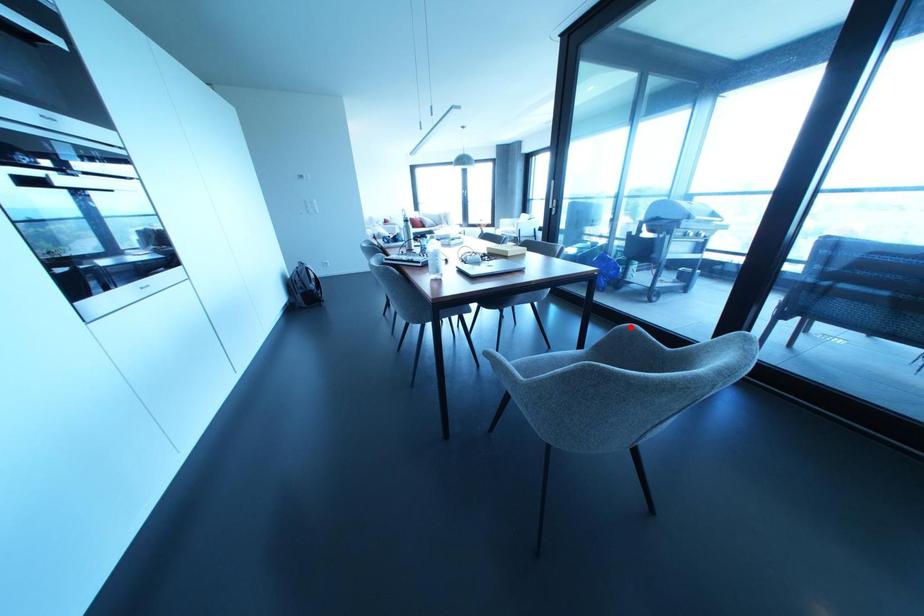
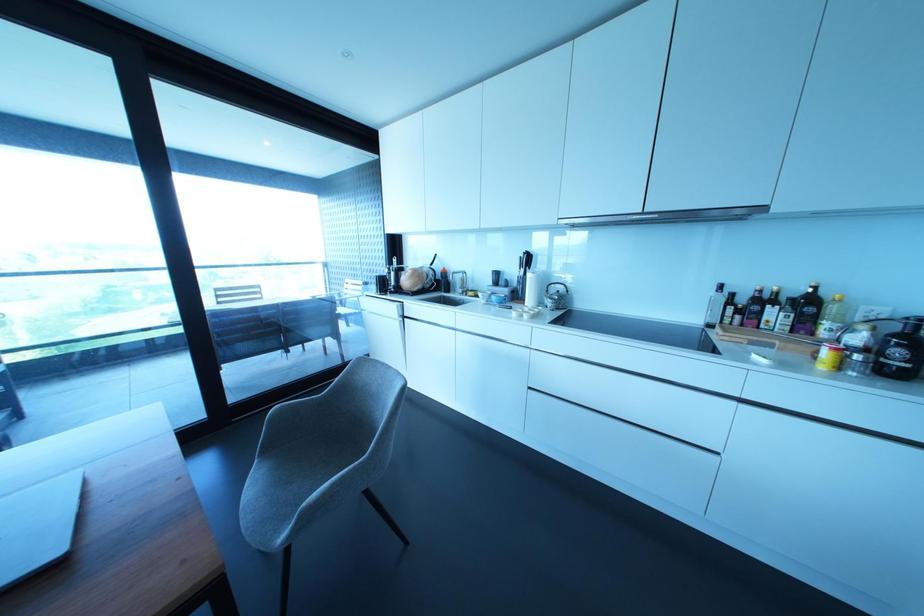
Question: I am providing you with two images of the same scene from different viewpoints. A red point is shown in image1. For the corresponding object point in image2, is it positioned nearer or farther from the camera?

Choices:
 (A) Nearer
 (B) Farther

Answer: (B)